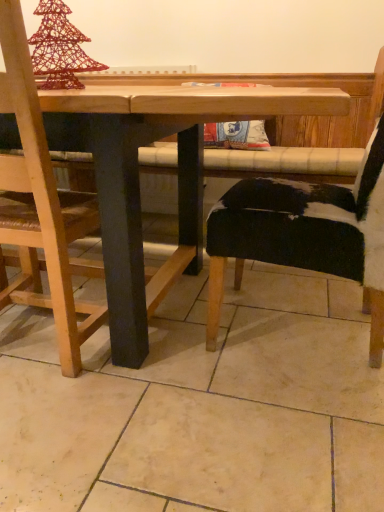
Question: From the image's perspective, would you say wooden table at center is positioned over wooden chair at left, the 2th chair viewed from the right?

Choices:
 (A) no
 (B) yes

Answer: (A)

Question: Can you see wooden table at center touching wooden chair at left, the 2th chair viewed from the right?

Choices:
 (A) yes
 (B) no

Answer: (B)

Question: From the image's perspective, is wooden table at center under wooden chair at left, which is the first chair in left-to-right order?

Choices:
 (A) no
 (B) yes

Answer: (B)

Question: Can you confirm if wooden table at center is taller than wooden chair at left, the 2th chair viewed from the right?

Choices:
 (A) no
 (B) yes

Answer: (A)

Question: From a real-world perspective, is wooden table at center located higher than wooden chair at left, the 2th chair viewed from the right?

Choices:
 (A) no
 (B) yes

Answer: (A)

Question: Considering the positions of point (107, 91) and point (349, 197), is point (107, 91) closer or farther from the camera than point (349, 197)?

Choices:
 (A) closer
 (B) farther

Answer: (A)

Question: Considering their positions, is wooden table at center located in front of or behind black cowhide chair at right, which is counted as the first chair, starting from the right?

Choices:
 (A) front
 (B) behind

Answer: (A)

Question: Considering the positions of wooden table at center and black cowhide chair at right, the second chair in the left-to-right sequence, in the image, is wooden table at center taller or shorter than black cowhide chair at right, the second chair in the left-to-right sequence,?

Choices:
 (A) short
 (B) tall

Answer: (A)

Question: From the image's perspective, is wooden table at center positioned above or below black cowhide chair at right, the second chair in the left-to-right sequence?

Choices:
 (A) below
 (B) above

Answer: (A)

Question: Considering the positions of wooden chair at left, the 2th chair viewed from the right, and wooden table at center in the image, is wooden chair at left, the 2th chair viewed from the right, bigger or smaller than wooden table at center?

Choices:
 (A) small
 (B) big

Answer: (A)

Question: In the image, is wooden chair at left, which is the first chair in left-to-right order, positioned in front of or behind wooden table at center?

Choices:
 (A) front
 (B) behind

Answer: (B)

Question: Is wooden chair at left, the 2th chair viewed from the right, wider or thinner than wooden table at center?

Choices:
 (A) thin
 (B) wide

Answer: (A)

Question: From the image's perspective, is wooden chair at left, which is the first chair in left-to-right order, positioned above or below wooden table at center?

Choices:
 (A) below
 (B) above

Answer: (B)

Question: Considering the positions of point (23, 135) and point (269, 231), is point (23, 135) closer or farther from the camera than point (269, 231)?

Choices:
 (A) closer
 (B) farther

Answer: (A)

Question: Is wooden chair at left, which is the first chair in left-to-right order, inside or outside of black cowhide chair at right, the second chair in the left-to-right sequence?

Choices:
 (A) inside
 (B) outside

Answer: (B)